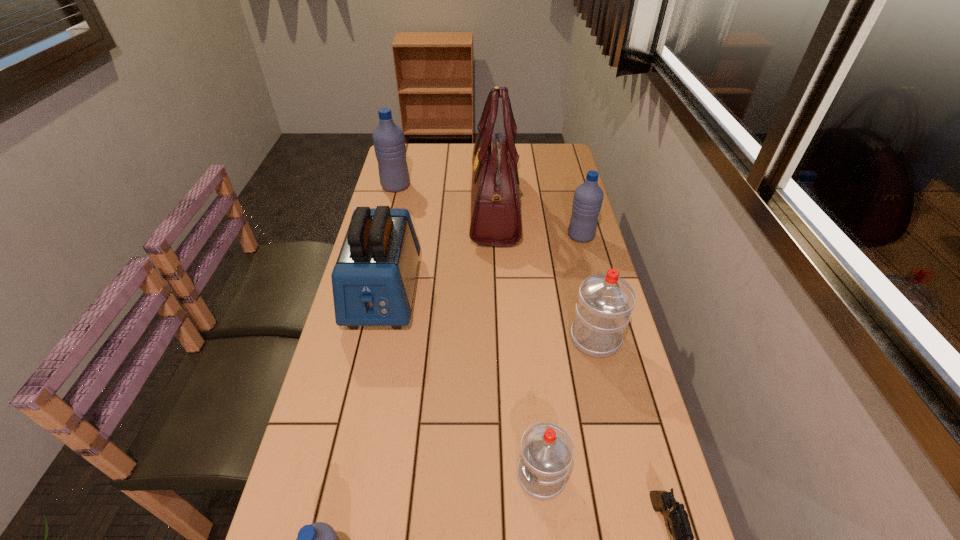
At what (x,y) coordinates should I click in order to perform the action: click on vacant area that satisfies the following two spatial constraints: 1. on the front-facing side of the brown handbag; 2. on the back side of the second smallest blue water bottle. Please return your answer as a coordinate pair (x, y). The image size is (960, 540). Looking at the image, I should click on (496, 236).